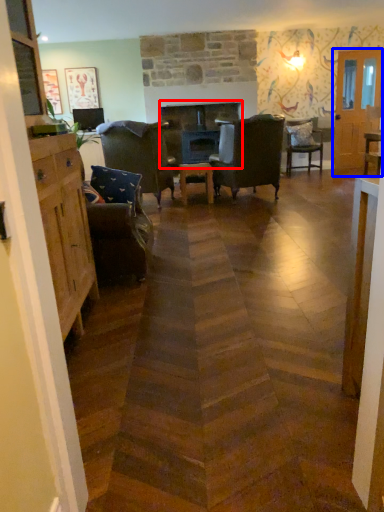
Question: Which object is further to the camera taking this photo, fireplace (highlighted by a red box) or glass door (highlighted by a blue box)?

Choices:
 (A) fireplace
 (B) glass door

Answer: (B)